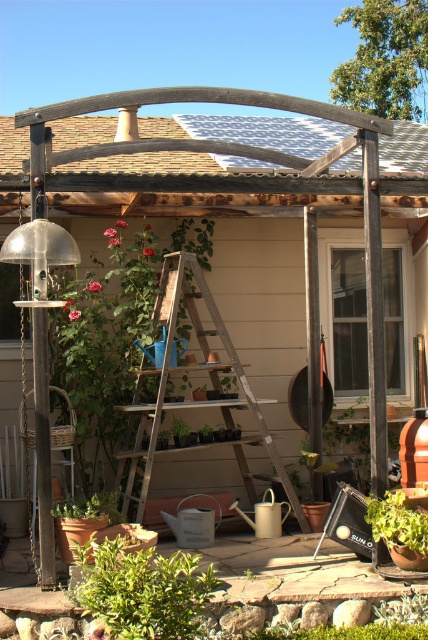
Question: Based on their relative distances, which object is nearer to the metallic tile roof at upper center?

Choices:
 (A) green leafy plant at center
 (B) green leafy plant at lower center
 (C) green matte plant at lower left
 (D) wooden ladder at center

Answer: (D)

Question: Among these points, which one is farthest from the camera?

Choices:
 (A) (183, 566)
 (B) (97, 492)

Answer: (B)

Question: Can you confirm if metallic tile roof at upper center is smaller than green leafy plant at center?

Choices:
 (A) no
 (B) yes

Answer: (B)

Question: Can you confirm if metallic tile roof at upper center is positioned above green matte plant at lower left?

Choices:
 (A) no
 (B) yes

Answer: (B)

Question: Which of the following is the farthest from the observer?

Choices:
 (A) green leafy plant at center
 (B) green leafy plant at lower center
 (C) wooden ladder at center

Answer: (C)

Question: Is wooden ladder at center wider than green matte plant at lower left?

Choices:
 (A) yes
 (B) no

Answer: (A)